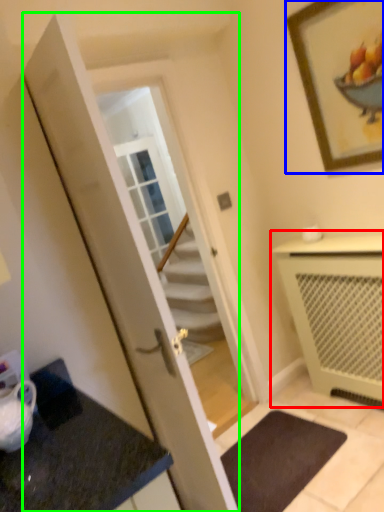
Question: Which object is positioned closest to cabinetry (highlighted by a red box)? Select from picture frame (highlighted by a blue box) and door (highlighted by a green box).

Choices:
 (A) picture frame
 (B) door

Answer: (A)